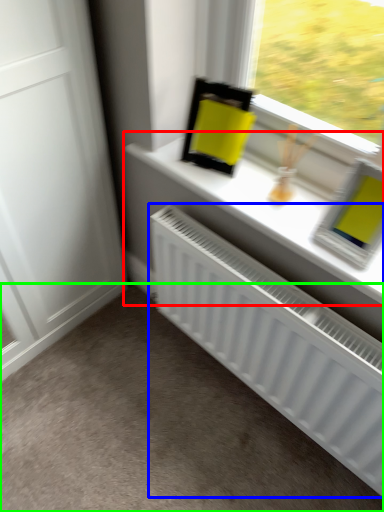
Question: Which is farther away from window sill (highlighted by a red box)? radiator (highlighted by a blue box) or plain (highlighted by a green box)?

Choices:
 (A) radiator
 (B) plain

Answer: (B)